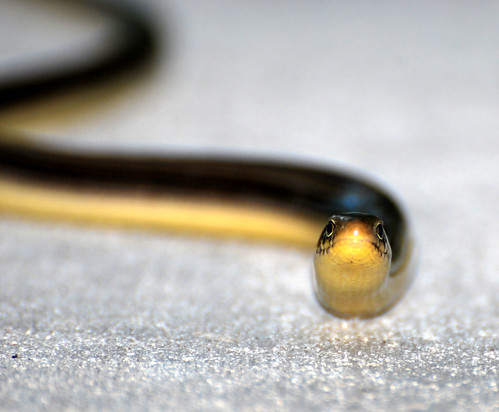
Where is `grey rug`? The image size is (499, 412). grey rug is located at coordinates (288, 365), (193, 346).